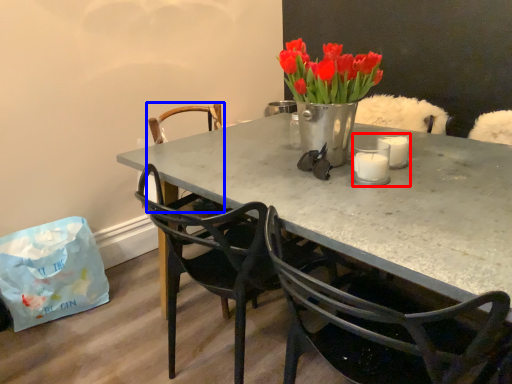
Question: Among these objects, which one is farthest to the camera, candle holder (highlighted by a red box) or chair (highlighted by a blue box)?

Choices:
 (A) candle holder
 (B) chair

Answer: (B)